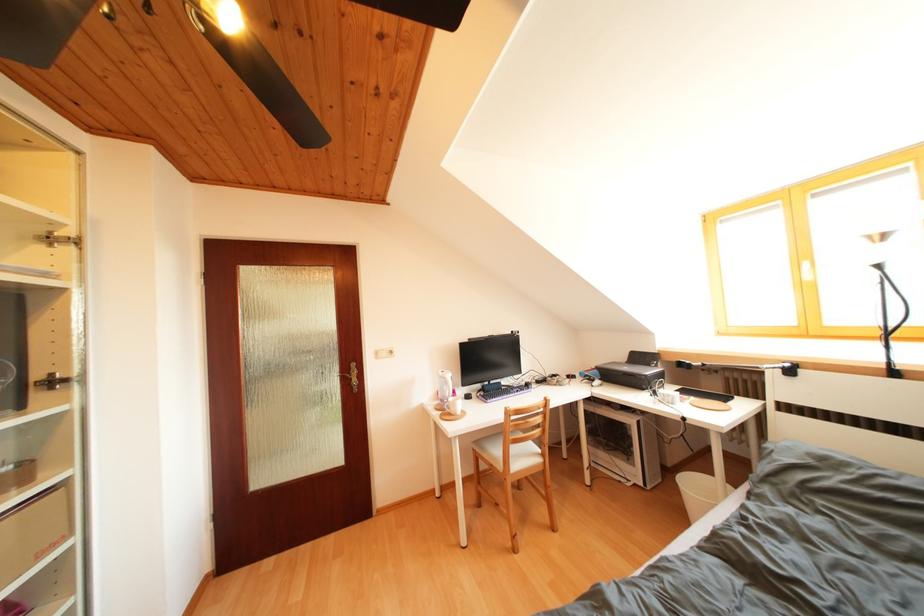
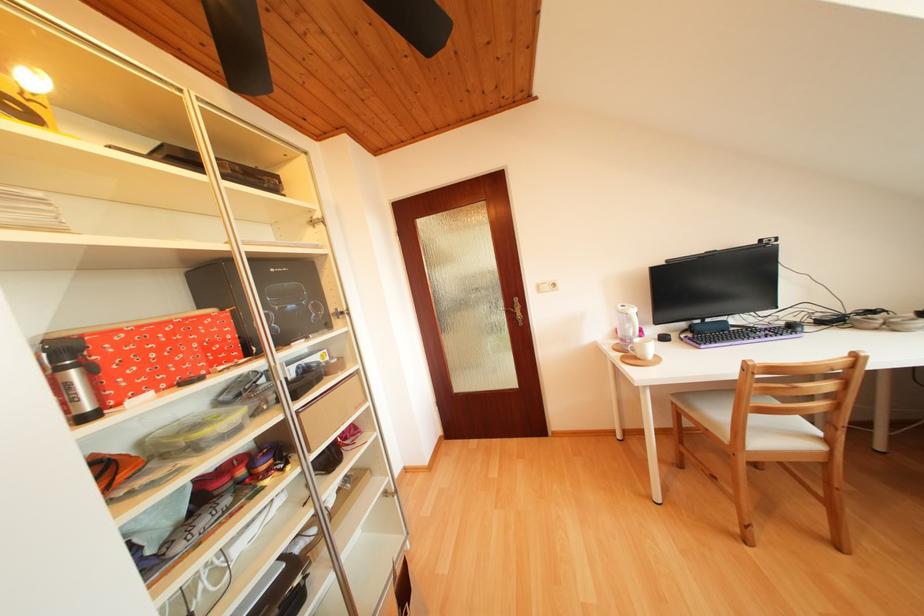
Find the pixel in the second image that matches point (535, 391) in the first image.

(799, 331)